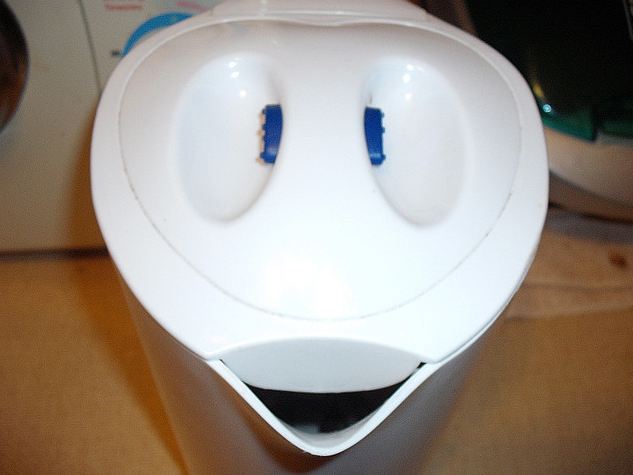
You are a GUI agent. You are given a task and a screenshot of the screen. Output one action in this format:
    pyautogui.click(x=<x>, y=<y>)
    Task: Click on the white rag with brown stain
    
    Given the screenshot: What is the action you would take?
    pyautogui.click(x=620, y=261)